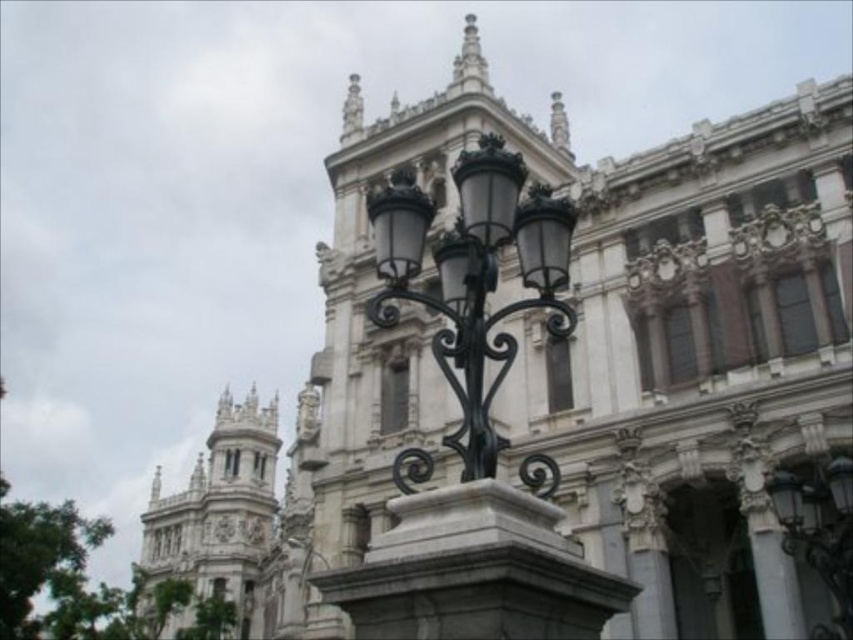
Question: Which is nearer to the black metal/iron streetlight at right?

Choices:
 (A) white stone tower at upper left
 (B) polished black metal street light at center

Answer: (B)

Question: Which of the following is the farthest from the observer?

Choices:
 (A) (788, 476)
 (B) (492, 273)

Answer: (A)

Question: Is polished black metal street light at center above white stone tower at upper left?

Choices:
 (A) yes
 (B) no

Answer: (A)

Question: Can you confirm if polished black metal street light at center is smaller than black metal/iron streetlight at right?

Choices:
 (A) yes
 (B) no

Answer: (B)

Question: Which point is closer to the camera taking this photo?

Choices:
 (A) (456, 346)
 (B) (793, 484)

Answer: (A)

Question: Considering the relative positions of polished black metal street light at center and black metal/iron streetlight at right in the image provided, where is polished black metal street light at center located with respect to black metal/iron streetlight at right?

Choices:
 (A) above
 (B) below

Answer: (A)